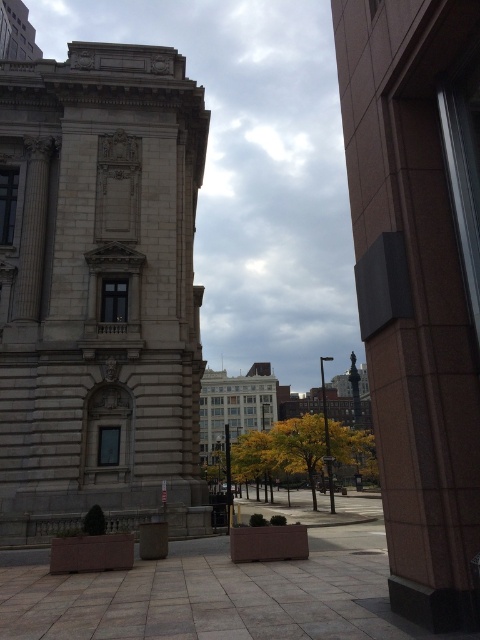
Looking at this image, you are a city planner assessing the urban space. You need to determine if the light beige stone tower at left can be seen from the base of the yellow leafy tree at center. Based on their sizes, can you confirm if the tower is taller than the tree?

The light beige stone tower at left has a smaller size compared to yellow leafy tree at center, so the tower is not taller than the tree. Therefore, it might be obscured depending on their positions.

From the picture: You are standing in front of the historic building and notice the light beige stone tower at left and the yellow leafy tree at center. Which one has a greater height?

The yellow leafy tree at center is taller than the light beige stone tower at left, so it has a greater height.

You are standing in front of the historic building and want to walk from point A to point B. Point A is located at coordinates point (194, 291) and point B is at point (348, 444). Which point is closer to you as you start your walk?

Point (194, 291) is closer to the viewer than point (348, 444), so you will start at the closer point.